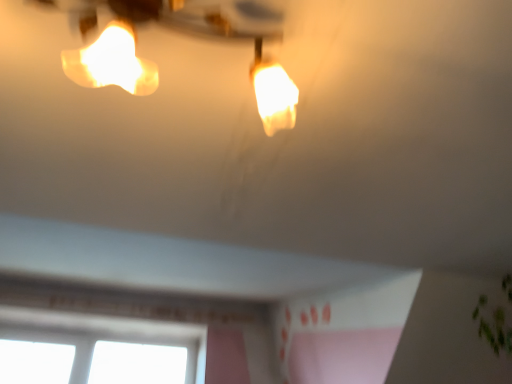
Find the location of a particular element. This screenshot has height=384, width=512. transparent glass window at lower left is located at coordinates (103, 335).

Image resolution: width=512 pixels, height=384 pixels. What do you see at coordinates (103, 335) in the screenshot?
I see `transparent glass window at lower left` at bounding box center [103, 335].

What is the approximate width of matte white lamp at upper center?

It is 5.78 inches.

What do you see at coordinates (184, 33) in the screenshot?
I see `matte white lamp at upper center` at bounding box center [184, 33].

Find the location of a particular element. matte white lamp at upper center is located at coordinates (184, 33).

The image size is (512, 384). Find the location of `transparent glass window at lower left`. transparent glass window at lower left is located at coordinates coord(103,335).

Can you confirm if matte white lamp at upper center is positioned to the left of transparent glass window at lower left?

In fact, matte white lamp at upper center is to the right of transparent glass window at lower left.

From the picture: Is matte white lamp at upper center closer to the viewer compared to transparent glass window at lower left?

Yes, matte white lamp at upper center is closer to the camera.

Which is closer, (293, 111) or (125, 329)?

Point (293, 111)

From the image's perspective, who appears lower, matte white lamp at upper center or transparent glass window at lower left?

transparent glass window at lower left, from the image's perspective.

From the picture: From a real-world perspective, is matte white lamp at upper center located beneath transparent glass window at lower left?

Indeed, from a real-world perspective, matte white lamp at upper center is positioned beneath transparent glass window at lower left.

Can you confirm if matte white lamp at upper center is wider than transparent glass window at lower left?

Yes.

Consider the image. Between matte white lamp at upper center and transparent glass window at lower left, which one has less height?

matte white lamp at upper center.

Looking at the image, does matte white lamp at upper center seem bigger or smaller compared to transparent glass window at lower left?

In the image, matte white lamp at upper center appears to be smaller than transparent glass window at lower left.

Is matte white lamp at upper center completely or partially outside of transparent glass window at lower left?

Yes.

Are matte white lamp at upper center and transparent glass window at lower left beside each other?

No, matte white lamp at upper center is not with transparent glass window at lower left.

Is matte white lamp at upper center oriented away from transparent glass window at lower left?

Absolutely, matte white lamp at upper center is directed away from transparent glass window at lower left.

Locate an element on the screen. Image resolution: width=512 pixels, height=384 pixels. window behind the matte white lamp at upper center is located at coordinates (103, 335).

Is transparent glass window at lower left to the left or to the right of matte white lamp at upper center in the image?

Based on their positions, transparent glass window at lower left is located to the left of matte white lamp at upper center.

Which object is further away from the camera taking this photo, transparent glass window at lower left or matte white lamp at upper center?

Positioned behind is transparent glass window at lower left.

Is point (143, 336) farther from camera compared to point (260, 11)?

Yes, it is.

From the image's perspective, relative to matte white lamp at upper center, is transparent glass window at lower left above or below?

Clearly, from the image's perspective, transparent glass window at lower left is below matte white lamp at upper center.

From a real-world perspective, is transparent glass window at lower left physically located above or below matte white lamp at upper center?

transparent glass window at lower left is situated higher than matte white lamp at upper center in the real world.

Between transparent glass window at lower left and matte white lamp at upper center, which one has larger width?

matte white lamp at upper center.

From their relative heights in the image, would you say transparent glass window at lower left is taller or shorter than matte white lamp at upper center?

Clearly, transparent glass window at lower left is taller compared to matte white lamp at upper center.

Considering the relative sizes of transparent glass window at lower left and matte white lamp at upper center in the image provided, is transparent glass window at lower left smaller than matte white lamp at upper center?

No, transparent glass window at lower left is not smaller than matte white lamp at upper center.

Would you say transparent glass window at lower left is inside or outside matte white lamp at upper center?

transparent glass window at lower left is located beyond the bounds of matte white lamp at upper center.

Can you see transparent glass window at lower left touching matte white lamp at upper center?

No, transparent glass window at lower left is not with matte white lamp at upper center.

Is transparent glass window at lower left positioned with its back to matte white lamp at upper center?

No, matte white lamp at upper center is not at the back of transparent glass window at lower left.

How much distance is there between transparent glass window at lower left and matte white lamp at upper center?

They are 7.85 feet apart.

The width and height of the screenshot is (512, 384). In order to click on lamp above the transparent glass window at lower left (from the image's perspective) in this screenshot , I will do `click(184, 33)`.

The height and width of the screenshot is (384, 512). Find the location of `window to the left of matte white lamp at upper center`. window to the left of matte white lamp at upper center is located at coordinates (103, 335).

This screenshot has width=512, height=384. I want to click on lamp below the transparent glass window at lower left (from a real-world perspective), so click(x=184, y=33).